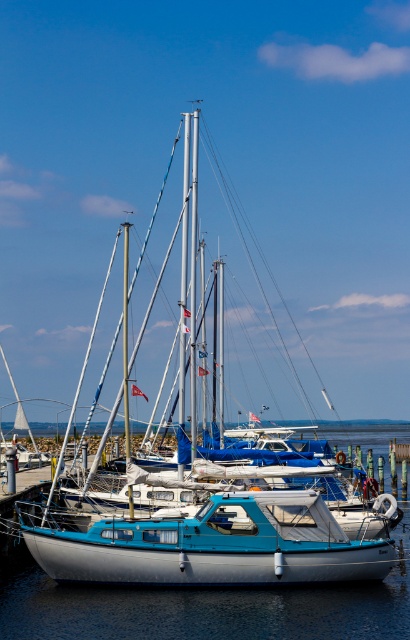
You are a photographer planning to take a photo of the blue matte sailboat at center and the blue metallic water at center. Which object should you focus on if you want to capture the tallest element in the scene?

The blue matte sailboat at center is much taller than the blue metallic water at center, so you should focus on the blue matte sailboat at center to capture the tallest element in the scene.

You are standing on the dock and see the blue matte sailboat at center and the blue metallic water at center. Which object is positioned to the left?

The blue matte sailboat at center is positioned to the left of the blue metallic water at center.

You are planning to take a photo of the teal glossy sailboat at center and the blue metallic water at center. Which object should you focus on first if you want to capture both in one frame without moving the camera?

The teal glossy sailboat at center is smaller than the blue metallic water at center, so you should focus on the teal glossy sailboat at center first to ensure it is in sharp focus before the larger area of water.